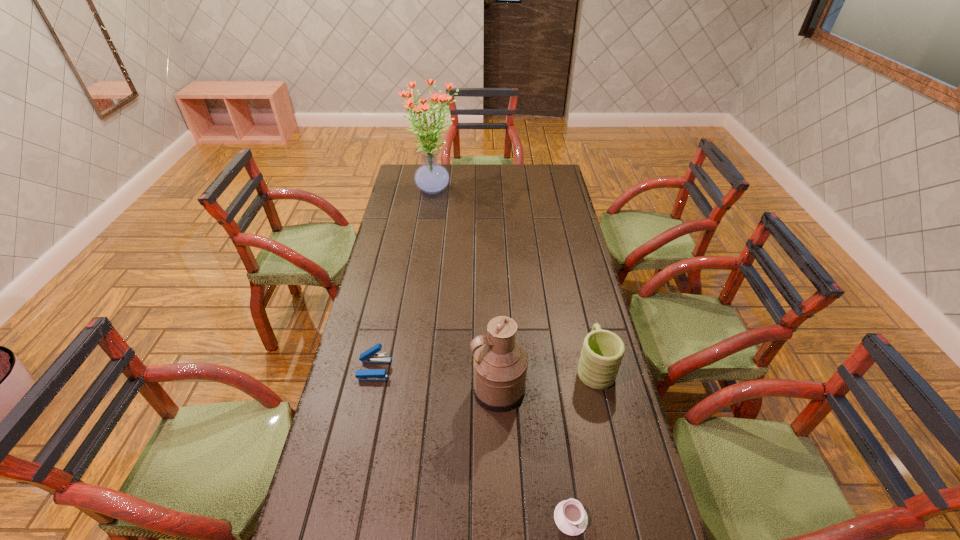
The height and width of the screenshot is (540, 960). I want to click on free space between the flower arrangement and the third object from left to right, so click(467, 289).

I want to click on vacant area that lies between the tallest object and the third tallest object, so click(515, 278).

The width and height of the screenshot is (960, 540). Find the location of `empty location between the second shortest object and the shortest object`. empty location between the second shortest object and the shortest object is located at coordinates (472, 444).

At what (x,y) coordinates should I click in order to perform the action: click on free area in between the tallest object and the second tallest object. Please return your answer as a coordinate pair (x, y). Looking at the image, I should click on (467, 289).

Where is `vacant area that lies between the third object from left to right and the teacup`? The width and height of the screenshot is (960, 540). vacant area that lies between the third object from left to right and the teacup is located at coordinates (535, 454).

This screenshot has height=540, width=960. I want to click on vacant space in between the stapler and the third object from left to right, so click(436, 380).

This screenshot has height=540, width=960. I want to click on vacant area that lies between the tallest object and the third shortest object, so click(x=515, y=278).

Identify the location of vacant space in between the rightmost object and the third object from left to right. (546, 379).

The width and height of the screenshot is (960, 540). What are the coordinates of `the second closest object to the flower arrangement` in the screenshot? It's located at (602, 352).

You are a GUI agent. You are given a task and a screenshot of the screen. Output one action in this format:
    pyautogui.click(x=<x>, y=<y>)
    Task: Click on the object that is the second closest one to the mug
    
    Given the screenshot: What is the action you would take?
    pyautogui.click(x=570, y=517)